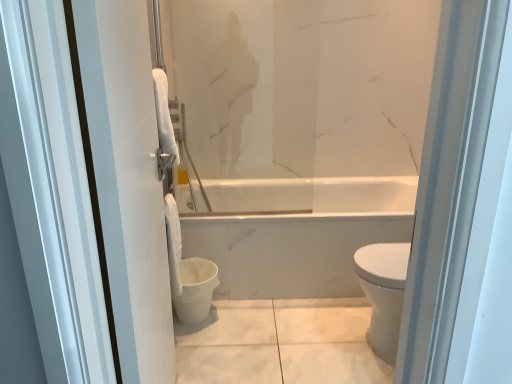
I want to click on vacant area that is situated to the right of white matte toilet bowl at lower center, so click(x=242, y=320).